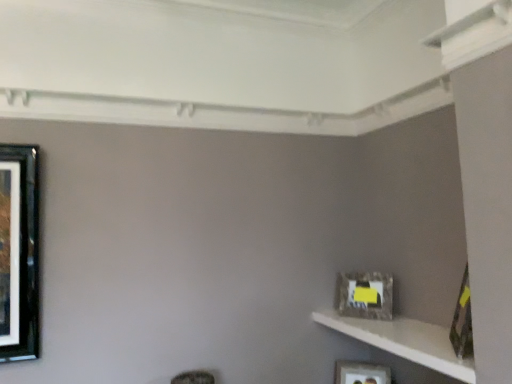
Question: Considering the positions of white textured shelf at lower right and matte gray frame at right, the 2th picture frame from the bottom, in the image, is white textured shelf at lower right bigger or smaller than matte gray frame at right, the 2th picture frame from the bottom,?

Choices:
 (A) small
 (B) big

Answer: (B)

Question: Based on their positions, is white textured shelf at lower right located to the left or right of matte gray frame at right, which is the second picture frame in top-to-bottom order?

Choices:
 (A) right
 (B) left

Answer: (A)

Question: Considering the real-world distances, which object is farthest from the matte black picture frame at lower right, the 1th picture frame in the bottom-to-top sequence?

Choices:
 (A) white textured shelf at lower right
 (B) matte gray frame at right, which is the second picture frame in top-to-bottom order
 (C) camouflage-patterned frame at right, the 1th picture frame when ordered from front to back

Answer: (C)

Question: Which object is positioned farthest from the matte gray frame at right, the 2th picture frame from the bottom?

Choices:
 (A) camouflage-patterned frame at right, placed as the third picture frame when sorted from back to front
 (B) white textured shelf at lower right
 (C) matte black picture frame at lower right, which is the third picture frame from front to back

Answer: (A)